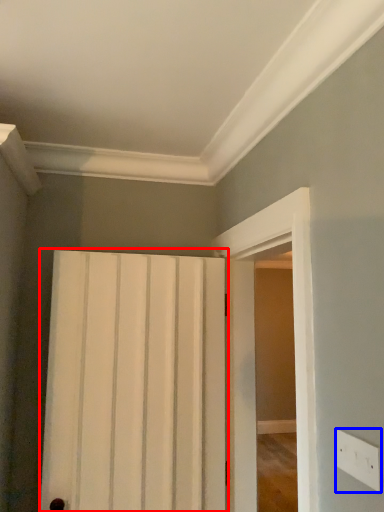
Question: Among these objects, which one is nearest to the camera, door (highlighted by a red box) or electric outlet (highlighted by a blue box)?

Choices:
 (A) door
 (B) electric outlet

Answer: (B)